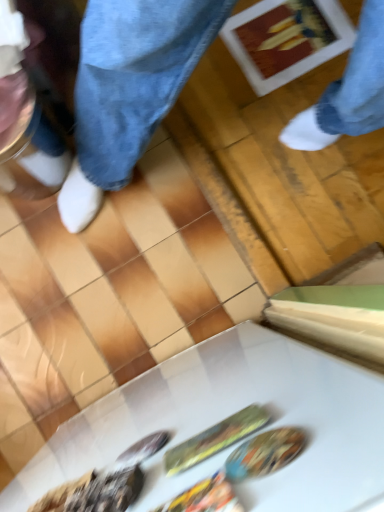
Question: From a real-world perspective, relative to shiny metallic spoon at lower left, placed as the first food when sorted from left to right, is shiny plastic spoon at center, which ranks as the third food in left-to-right order, vertically above or below?

Choices:
 (A) above
 (B) below

Answer: (B)

Question: In terms of width, does shiny plastic spoon at center, arranged as the first food when viewed from the right, look wider or thinner when compared to shiny metallic spoon at lower left, placed as the first food when sorted from left to right?

Choices:
 (A) thin
 (B) wide

Answer: (A)

Question: Which object is positioned closest to the white glossy table at lower center?

Choices:
 (A) shiny plastic bag at center, the second food from the left
 (B) shiny plastic spoon at center, arranged as the first food when viewed from the right
 (C) shiny metallic spoon at lower left, the third food from the right

Answer: (C)

Question: Estimate the real-world distances between objects in this image. Which object is farther from the shiny plastic spoon at center, arranged as the first food when viewed from the right?

Choices:
 (A) white glossy table at lower center
 (B) shiny plastic bag at center, positioned as the second food in right-to-left order
 (C) shiny metallic spoon at lower left, the third food from the right

Answer: (A)